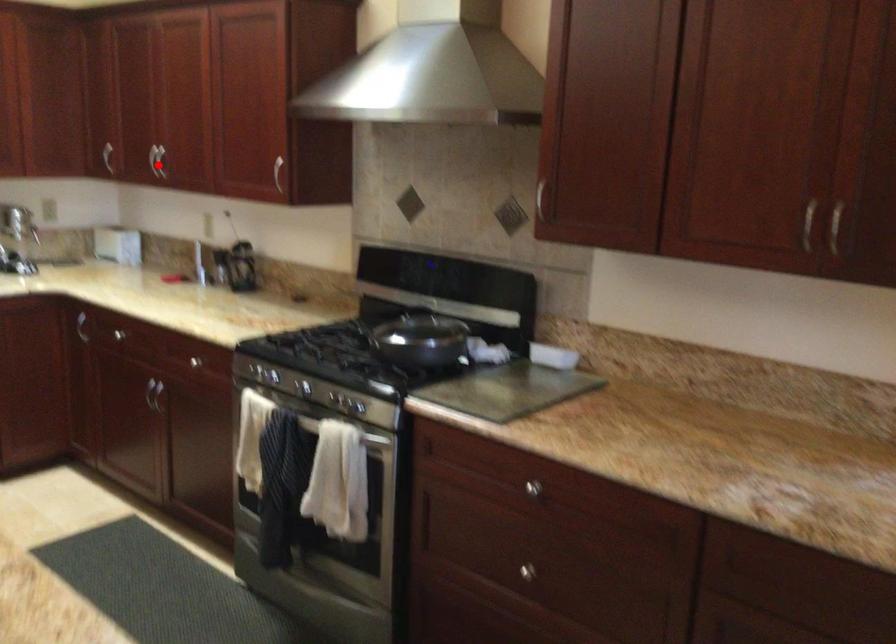
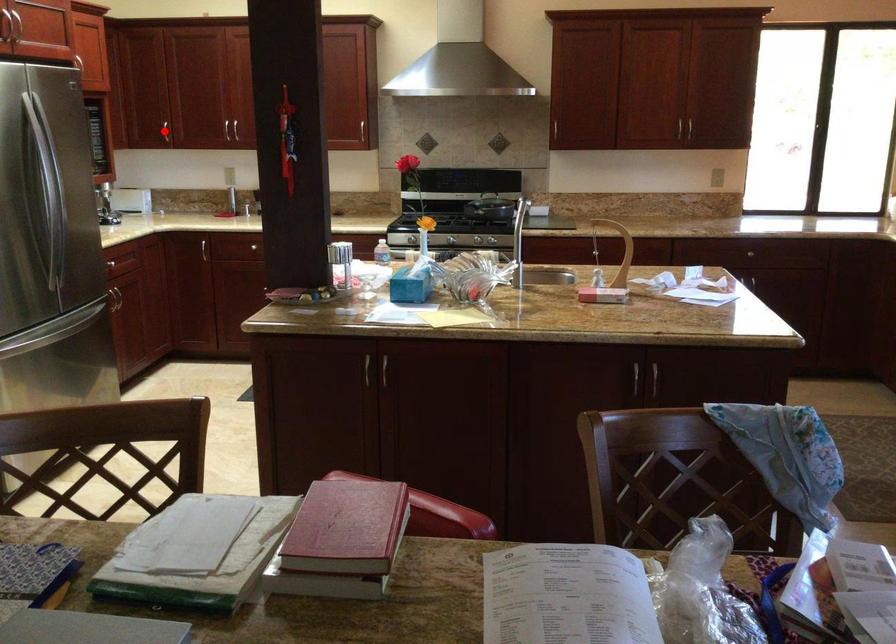
I am providing you with two images of the same scene from different viewpoints. A red point is marked on the first image and another point is marked on the second image. Do the highlighted points in image1 and image2 indicate the same real-world spot?

Yes